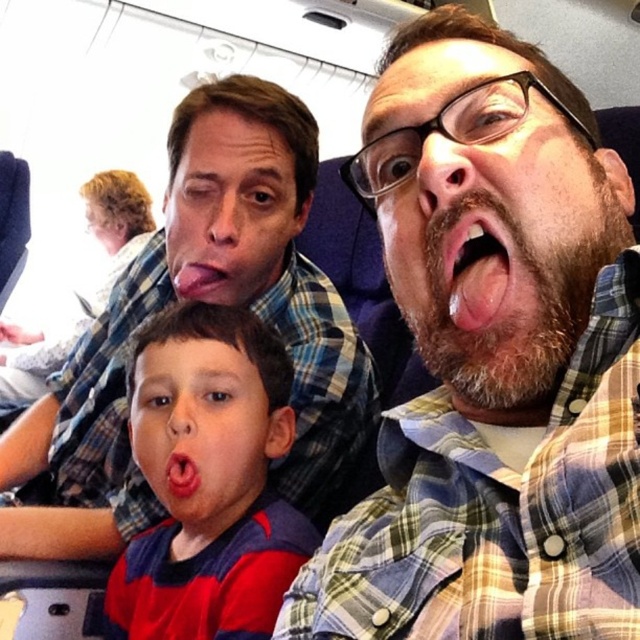
Question: Estimate the real-world distances between objects in this image. Which object is closer to the matte plaid shirt at upper center?

Choices:
 (A) red plaid shirt at center
 (B) plaid shirt at center
 (C) pink glossy tongue at center

Answer: (A)

Question: Does plaid shirt at center appear on the right side of pink glossy tongue at center?

Choices:
 (A) no
 (B) yes

Answer: (A)

Question: Can you confirm if plaid shirt at center is positioned above pink glossy tongue at center?

Choices:
 (A) yes
 (B) no

Answer: (B)

Question: From the image, what is the correct spatial relationship of plaid shirt at center in relation to red plaid shirt at center?

Choices:
 (A) right
 (B) left

Answer: (A)

Question: Which object appears closest to the camera in this image?

Choices:
 (A) red plaid shirt at center
 (B) pink glossy tongue at center

Answer: (B)

Question: Which point appears farthest from the camera in this image?

Choices:
 (A) (58, 394)
 (B) (464, 212)
 (C) (234, 564)
 (D) (531, 541)

Answer: (A)